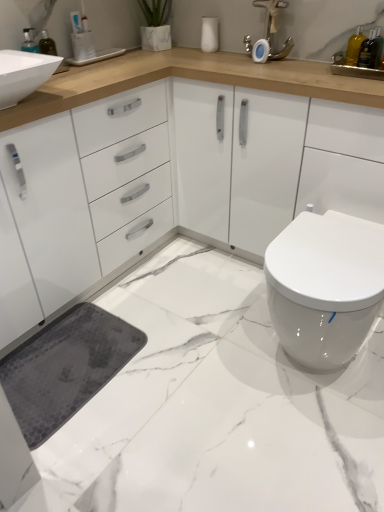
Identify the location of free region on the left part of translucent glass bottle at upper right, arranged as the second toiletry when viewed from the back. click(x=321, y=70).